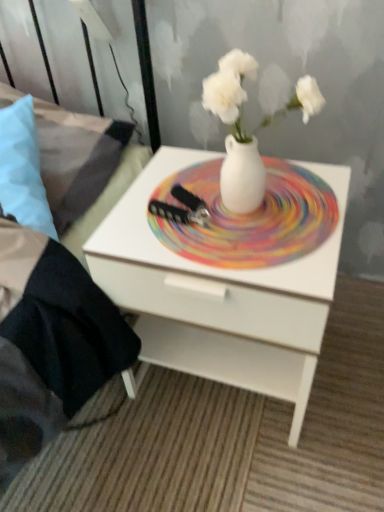
Where is `free spot in front of white matte vase at center`? This screenshot has width=384, height=512. free spot in front of white matte vase at center is located at coordinates pyautogui.click(x=269, y=254).